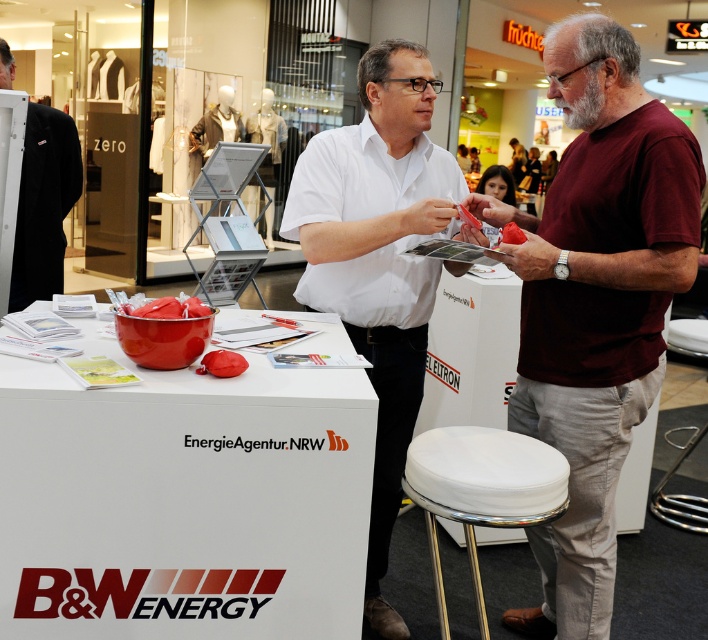
Who is taller, maroon t-shirt at right or black fabric coat at left?

Standing taller between the two is maroon t-shirt at right.

Can you confirm if maroon t-shirt at right is shorter than black fabric coat at left?

Incorrect, maroon t-shirt at right's height does not fall short of black fabric coat at left's.

Is point (599, 484) positioned before point (35, 282)?

Yes, point (599, 484) is in front of point (35, 282).

I want to click on maroon t-shirt at right, so click(x=595, y=301).

Who is more distant from viewer, (455, 268) or (42, 161)?

The point (42, 161) is more distant.

This screenshot has height=640, width=708. In order to click on white matte shirt at center in this screenshot , I will do `click(379, 260)`.

At what (x,y) coordinates should I click in order to perform the action: click on white matte shirt at center. Please return your answer as a coordinate pair (x, y). This screenshot has width=708, height=640. Looking at the image, I should click on pos(379,260).

Measure the distance between white fabric stool at lower center and black fabric coat at left.

white fabric stool at lower center is 1.94 meters away from black fabric coat at left.

Between white fabric stool at lower center and black fabric coat at left, which one is positioned higher?

black fabric coat at left is higher up.

Does point (438, 602) come in front of point (28, 128)?

Yes, it is in front of point (28, 128).

This screenshot has width=708, height=640. Find the location of `white fabric stool at lower center`. white fabric stool at lower center is located at coordinates (481, 490).